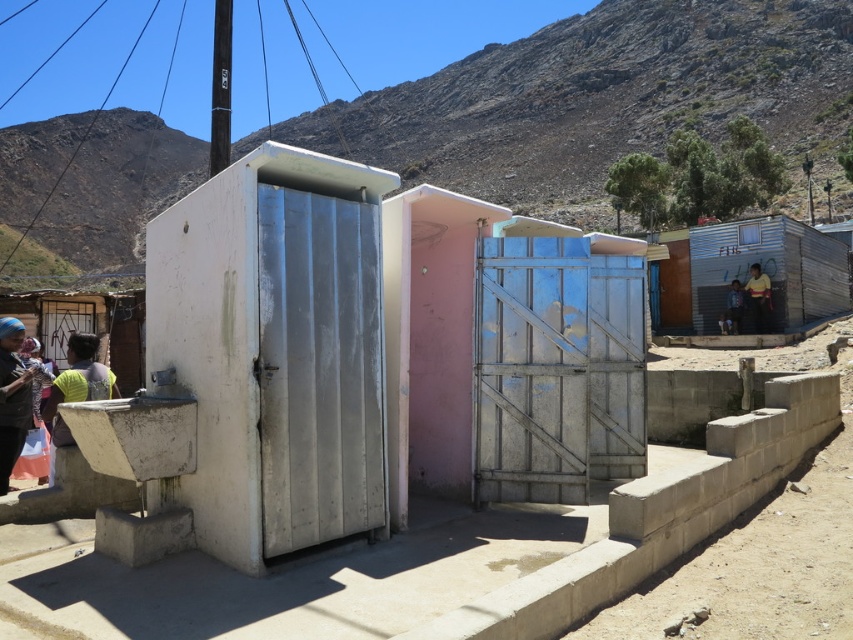
In the scene shown: You are standing at the point marked by the coordinates point (76, 388). Looking around, you see the portable toilets on the concrete platform and the water basin to the left. Which direction should you move to reach the water basin?

The point (76, 388) indicates green fabric shirt at left, so you should move to the left to reach the water basin located to the left of the toilets.